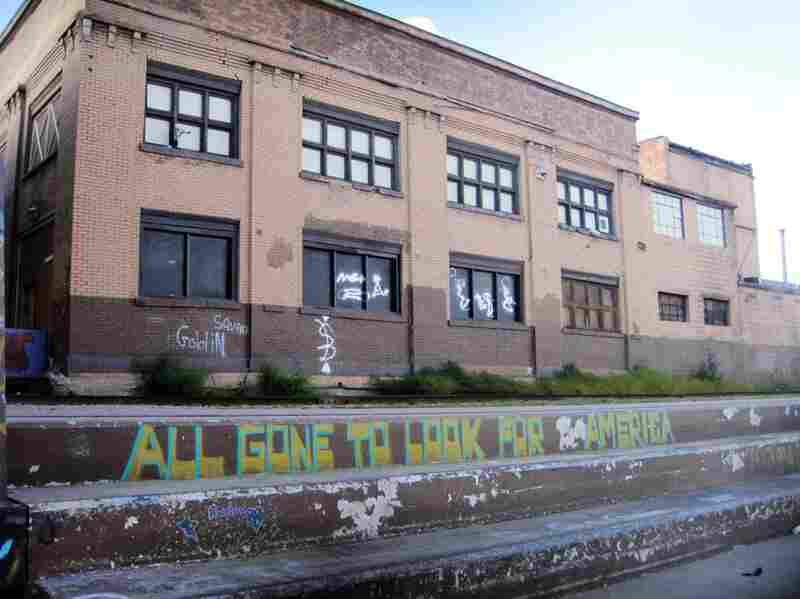
Find the location of a particular element. The height and width of the screenshot is (599, 800). rectangular windows is located at coordinates (154, 252), (198, 256), (312, 282), (346, 276), (372, 275).